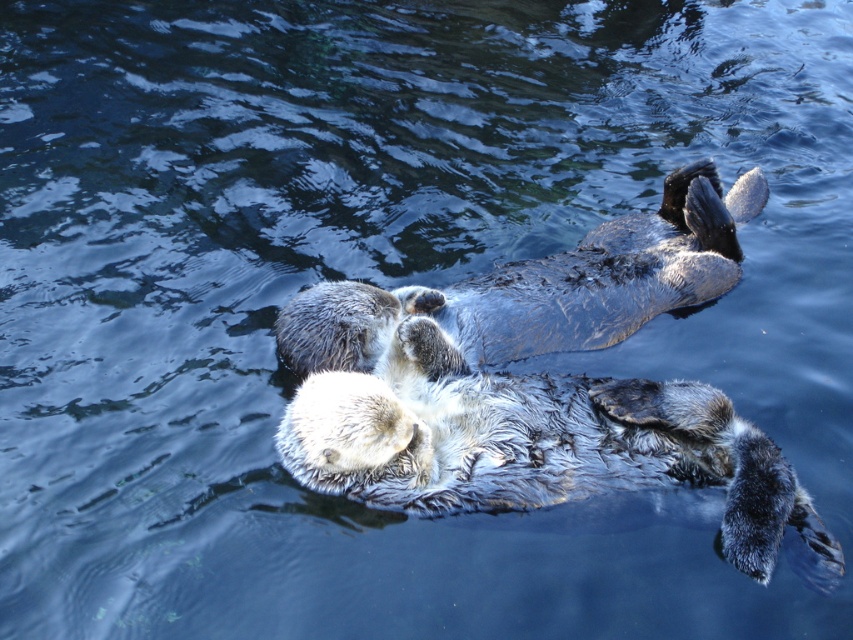
Question: In this image, where is soft brown fur otter at center located relative to gray-furred otter at center?

Choices:
 (A) left
 (B) right

Answer: (B)

Question: Which of the following is the farthest from the observer?

Choices:
 (A) (329, 460)
 (B) (570, 307)

Answer: (B)

Question: Does soft brown fur otter at center have a smaller size compared to gray-furred otter at center?

Choices:
 (A) yes
 (B) no

Answer: (A)

Question: Which of the following is the closest to the observer?

Choices:
 (A) soft brown fur otter at center
 (B) gray-furred otter at center

Answer: (A)

Question: Does soft brown fur otter at center have a smaller size compared to gray-furred otter at center?

Choices:
 (A) yes
 (B) no

Answer: (A)